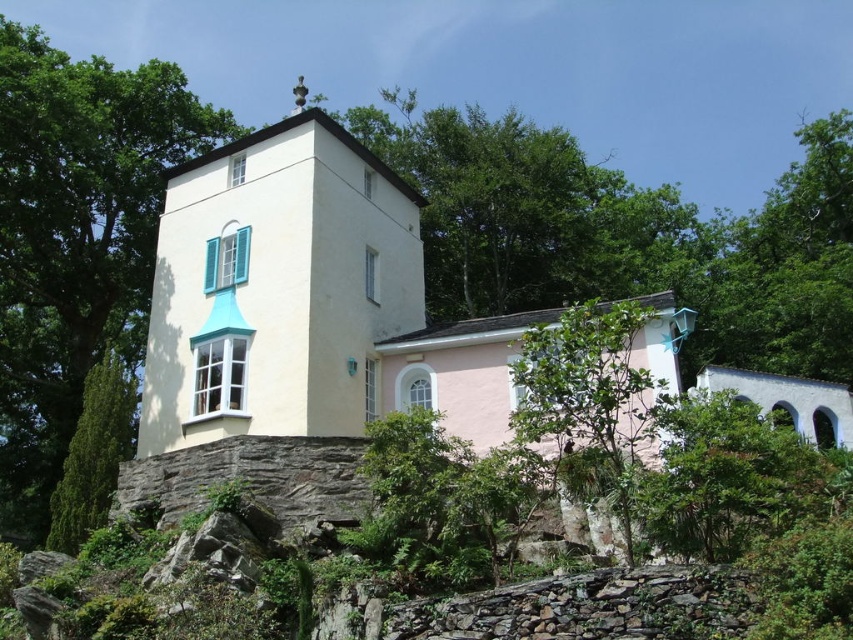
From the picture: You are standing in front of the house and want to walk towards the white smooth stone chapel at center and the green leafy tree at center. Which one will you reach first?

You will reach the white smooth stone chapel at center first because it is closer to you than the green leafy tree at center.